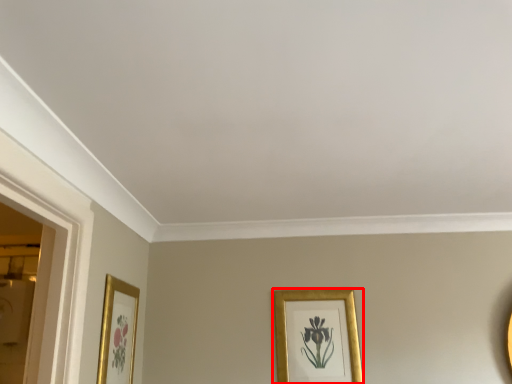
Question: From the image's perspective, what is the correct spatial relationship of picture frame (annotated by the red box) in relation to picture frame?

Choices:
 (A) above
 (B) below

Answer: (B)